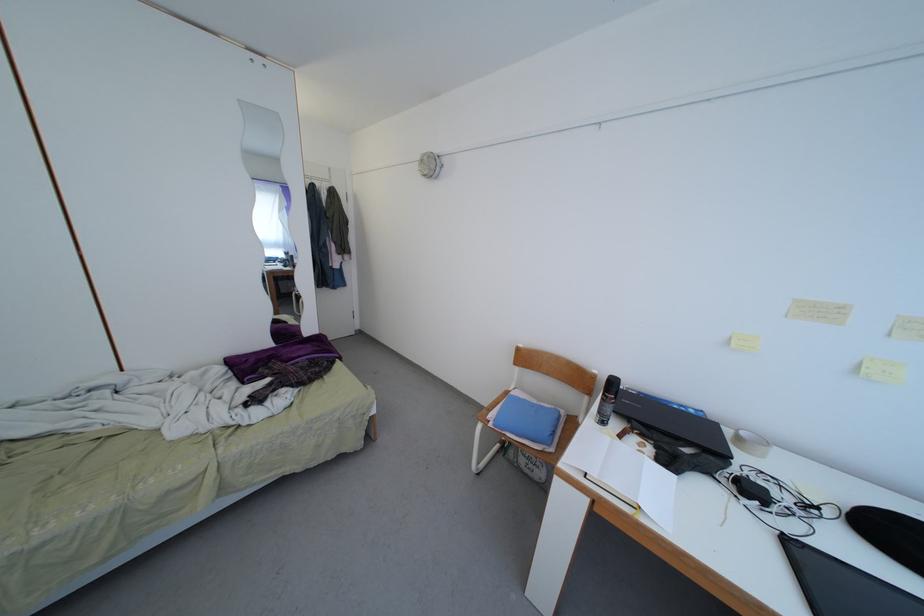
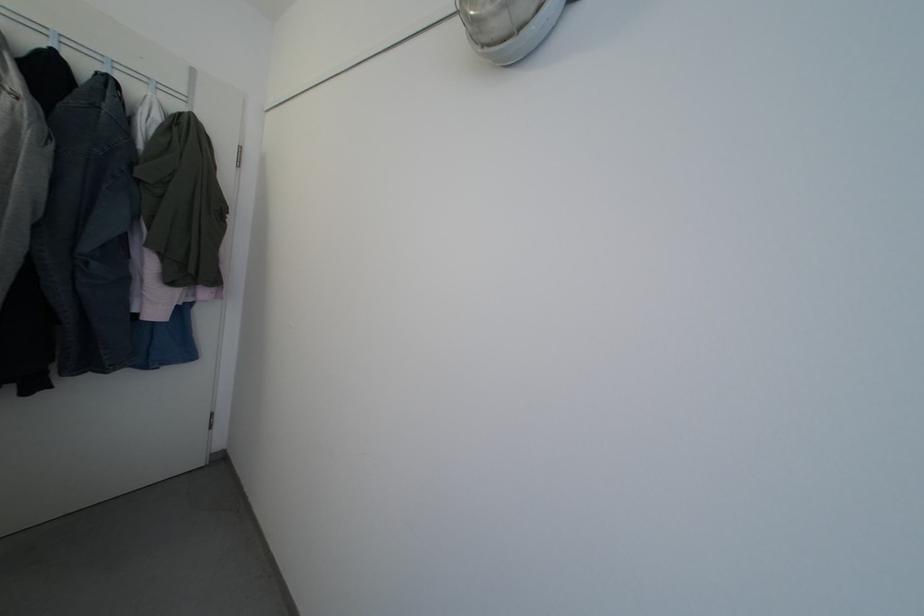
Question: What movement of the cameraman would produce the second image?

Choices:
 (A) Left
 (B) Right
 (C) Forward
 (D) Backward

Answer: (C)